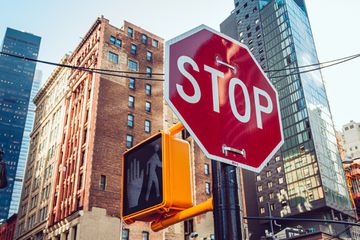
The width and height of the screenshot is (360, 240). Identify the location of window. (128, 120).